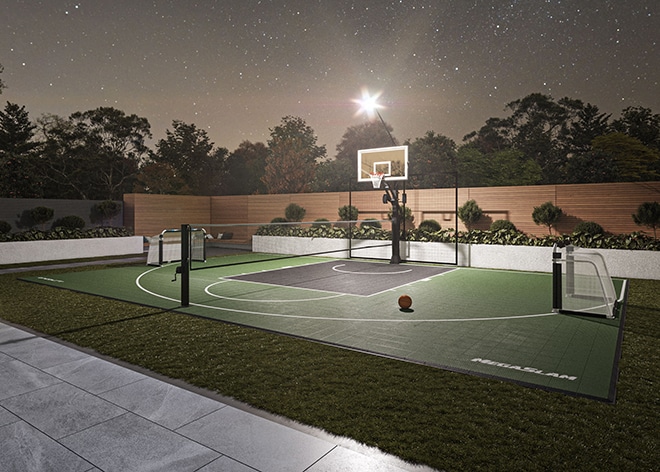
The image size is (660, 472). Identify the location of wall. (512, 200).